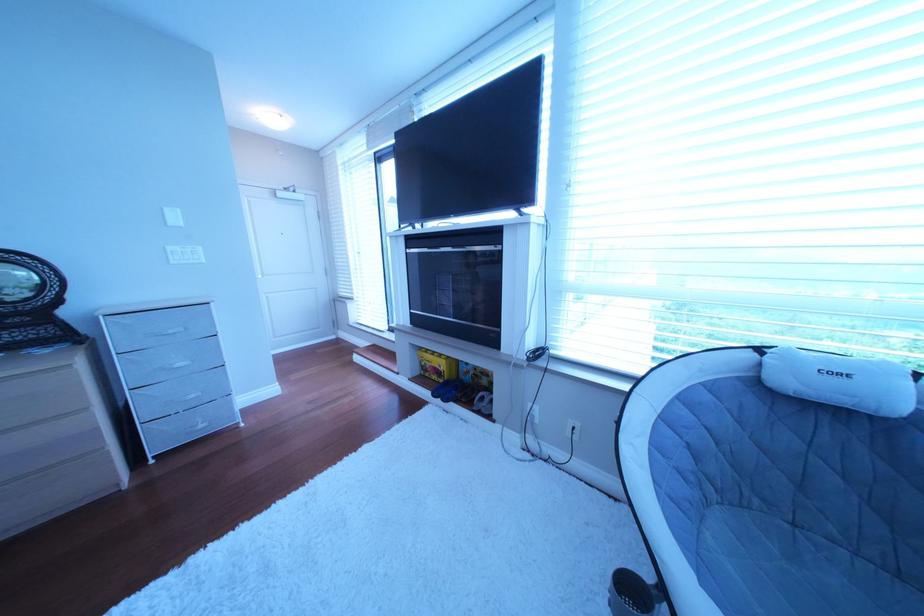
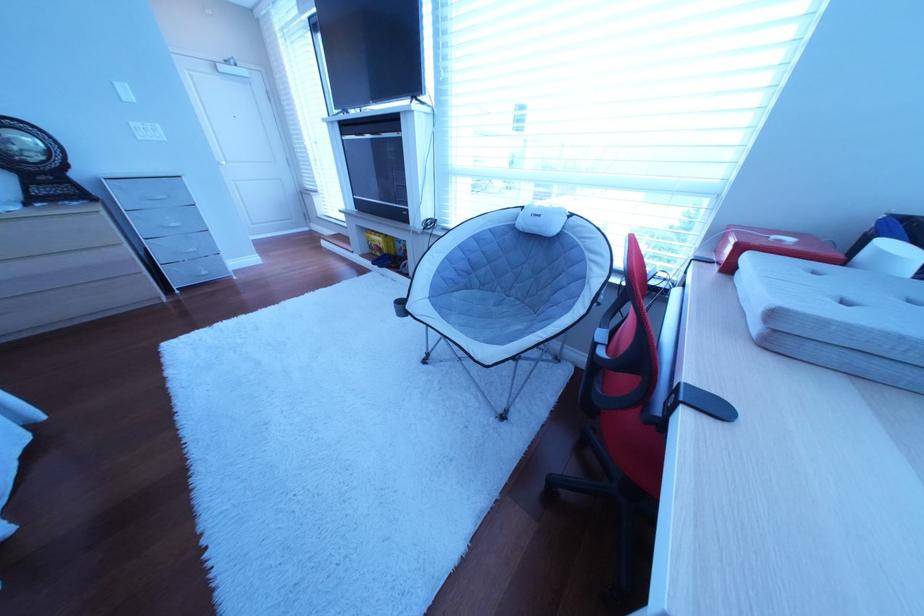
The images are taken continuously from a first-person perspective. In which direction are you moving?

The movement direction of the cameraman is right, backward.